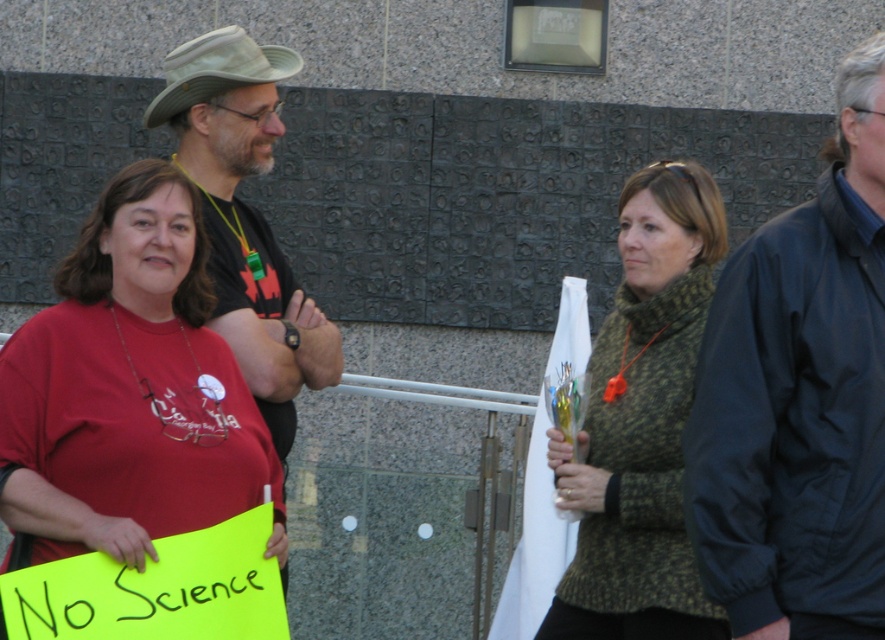
Question: Is green knitted sweater at center positioned before green fabric hat at upper center?

Choices:
 (A) yes
 (B) no

Answer: (A)

Question: Is green knitted sweater at center below yellow paper sign at lower left?

Choices:
 (A) yes
 (B) no

Answer: (B)

Question: Is green knitted sweater at center below yellow paper sign at lower left?

Choices:
 (A) yes
 (B) no

Answer: (B)

Question: Which object is the closest to the green knitted sweater at center?

Choices:
 (A) dark blue jacket at right
 (B) matte black shirt at center
 (C) yellow paper sign at lower left

Answer: (A)

Question: Which object is the closest to the green fabric hat at upper center?

Choices:
 (A) yellow paper sign at lower left
 (B) matte red t-shirt at center
 (C) dark blue jacket at right
 (D) green knitted sweater at center

Answer: (B)

Question: Which of the following is the farthest from the observer?

Choices:
 (A) (168, 120)
 (B) (876, 177)
 (C) (129, 296)

Answer: (A)